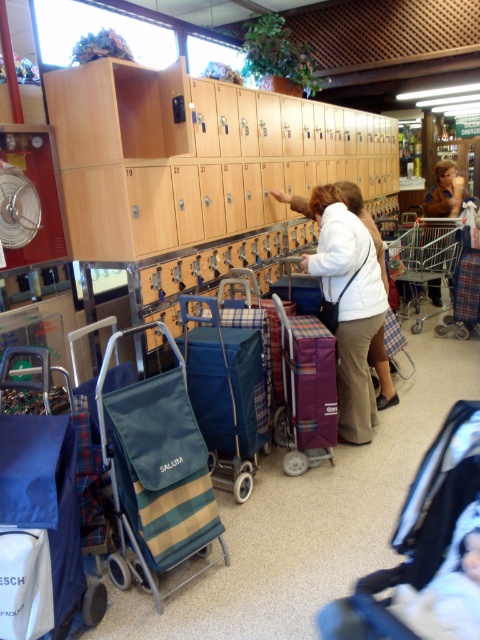
You are standing at the entrance of the store and see two points marked in the image. The first point is at coordinate point (x=163, y=394) and the second is at point (x=432, y=211). If you want to walk from the entrance towards the lockers, which point should you aim for first?

Point (x=163, y=394) is in front of point (x=432, y=211), so you should aim for point (x=163, y=394) first as it is closer to your current position at the entrance.

You are a customer in the store and need to find a trolley. You see the green striped fabric trolley at center and the blue fabric trolley at lower left. Which one is positioned to the right of the other?

The green striped fabric trolley at center is positioned to the right of the blue fabric trolley at lower left.